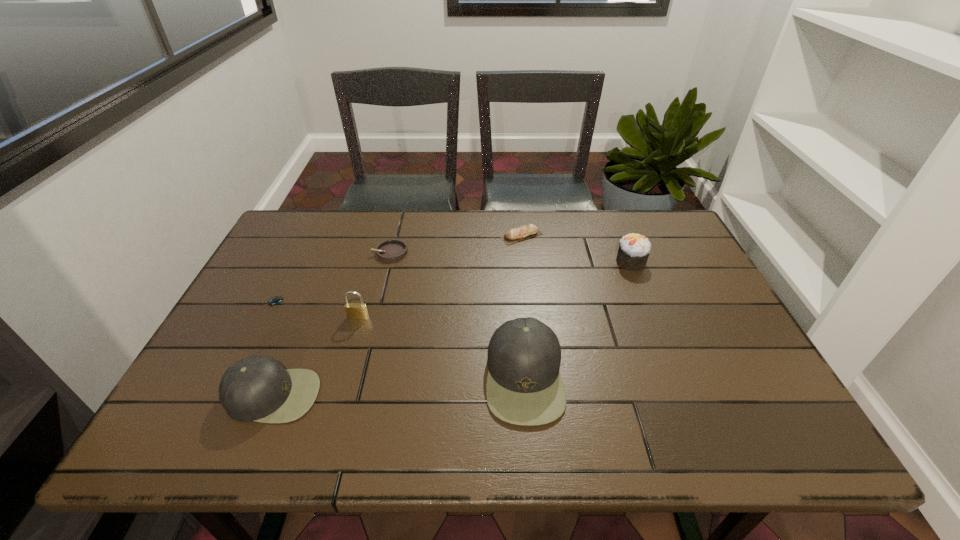
Locate an element on the screen. free region located 0.190m on the brim of the taller cap is located at coordinates (401, 377).

Image resolution: width=960 pixels, height=540 pixels. In order to click on free space located on the brim of the taller cap in this screenshot , I will do `click(357, 377)`.

Image resolution: width=960 pixels, height=540 pixels. Identify the location of free space located 0.220m on the back of the cupcake. (612, 213).

I want to click on free region located 0.270m on the front of the second shortest object, so click(371, 330).

Where is `free space located 0.230m on the left of the fifth tallest object`? free space located 0.230m on the left of the fifth tallest object is located at coordinates (427, 235).

Where is `free space located on the front-facing side of the third nearest object`? The image size is (960, 540). free space located on the front-facing side of the third nearest object is located at coordinates (343, 371).

You are a GUI agent. You are given a task and a screenshot of the screen. Output one action in this format:
    pyautogui.click(x=<x>, y=<y>)
    Task: Click on the vacant space located 0.270m on the right of the shortest object
    
    Given the screenshot: What is the action you would take?
    pyautogui.click(x=383, y=304)

This screenshot has width=960, height=540. I want to click on cupcake that is positioned at the far edge, so click(x=634, y=249).

Locate an element on the screen. This screenshot has height=540, width=960. ashtray that is at the far edge is located at coordinates (390, 251).

Image resolution: width=960 pixels, height=540 pixels. In order to click on pita bread that is at the far edge in this screenshot , I will do `click(520, 233)`.